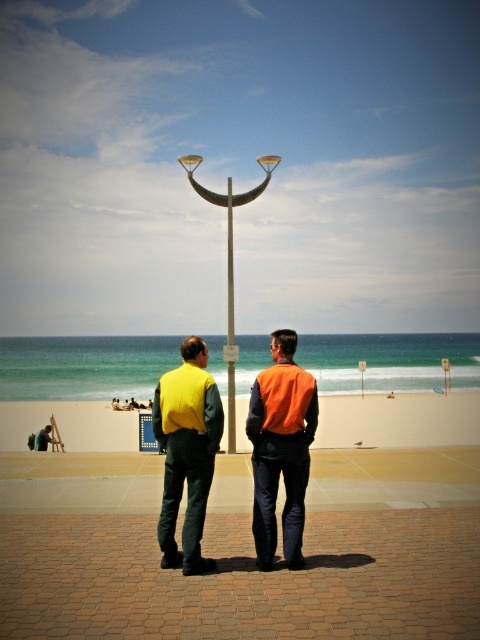
Question: Where is orange fabric vest at center located in relation to matte yellow vest at lower left in the image?

Choices:
 (A) right
 (B) left

Answer: (A)

Question: Which object appears farthest from the camera in this image?

Choices:
 (A) orange fabric vest at center
 (B) matte yellow vest at center
 (C) matte orange vest at center
 (D) matte yellow vest at lower left

Answer: (D)

Question: From the image, what is the correct spatial relationship of matte orange vest at center in relation to matte yellow vest at lower left?

Choices:
 (A) below
 (B) above

Answer: (B)

Question: Estimate the real-world distances between objects in this image. Which object is farther from the matte orange vest at center?

Choices:
 (A) orange fabric vest at center
 (B) metallic silver pole at center

Answer: (B)

Question: Does matte yellow vest at center have a smaller size compared to matte yellow vest at lower left?

Choices:
 (A) yes
 (B) no

Answer: (B)

Question: Which of the following is the closest to the observer?

Choices:
 (A) orange fabric vest at center
 (B) matte yellow vest at center

Answer: (B)